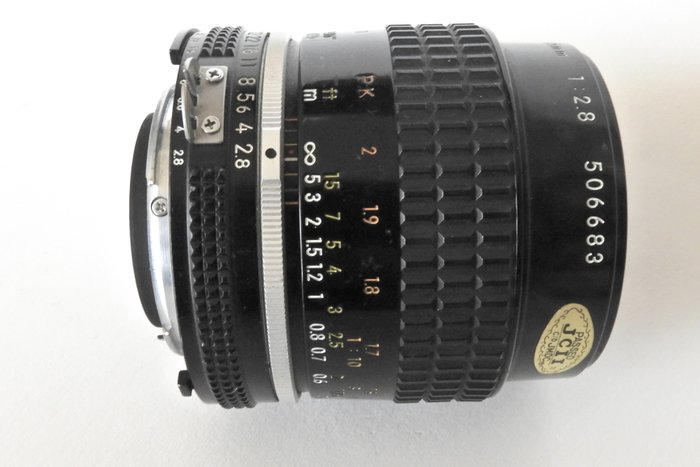
Where is `hook`? The width and height of the screenshot is (700, 467). hook is located at coordinates point(197,375).